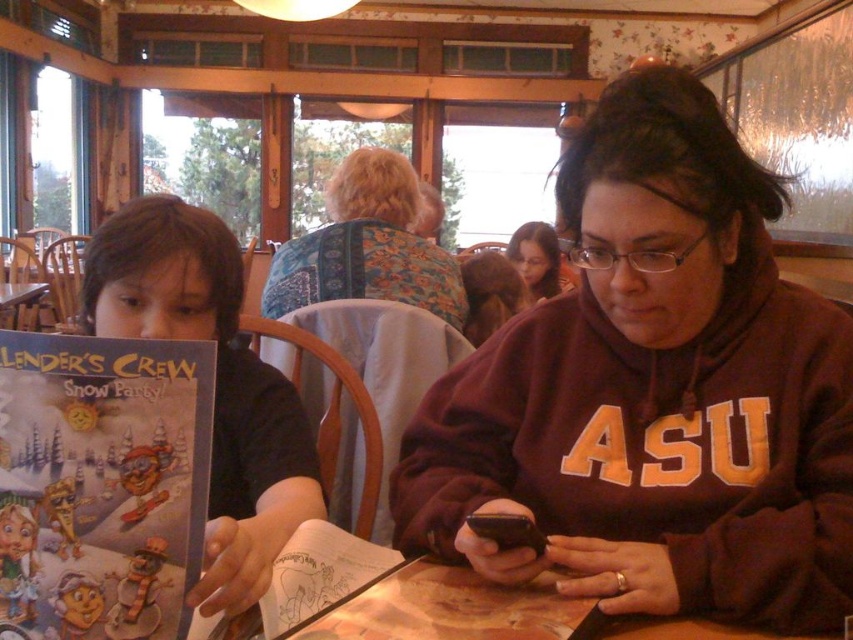
You are a customer in this cozy restaurant and you want to place your new matte paper book at center on the table. However, there is already a cartoon paper book at left on the table. Where should you place the matte paper book to avoid covering the cartoon paper book?

The cartoon paper book at left is located above the matte paper book at center, so you should place the matte paper book at center below the cartoon paper book at left to avoid covering it.

You are standing at the entrance of the restaurant and want to walk towards the point marked as point (583, 600). However, there is an obstacle at point (532, 545). Will you encounter the obstacle before reaching your destination?

Yes, you will encounter the obstacle at point (532, 545) before reaching point (583, 600) because point (583, 600) is in front of point (532, 545) from your starting position at the entrance.

You are a photographer trying to capture a closeup of the matte paper book at center and the matte brown hair at upper center in the scene. Which object should you focus on first to ensure it appears sharp in the photo?

You should focus on the matte paper book at center first because it is closer to the viewer than the matte brown hair at upper center, so adjusting focus from near to far will help capture both sharply.